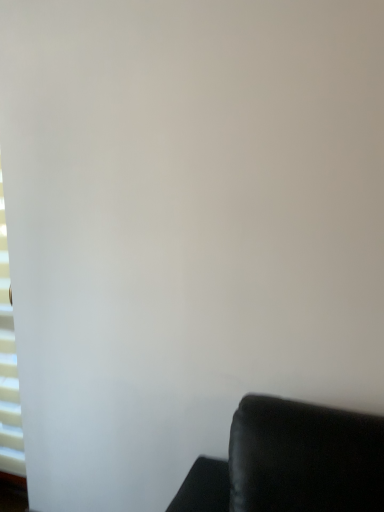
The width and height of the screenshot is (384, 512). What do you see at coordinates (8, 366) in the screenshot? I see `white plastic shutter at left` at bounding box center [8, 366].

Identify the location of white plastic shutter at left. The height and width of the screenshot is (512, 384). coord(8,366).

Identify the location of white plastic shutter at left. (8, 366).